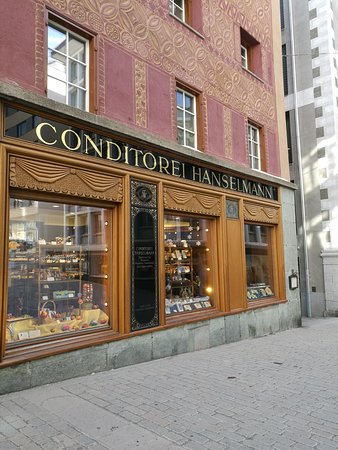
Find the location of a particular element. The height and width of the screenshot is (450, 338). ceiling is located at coordinates (44, 204).